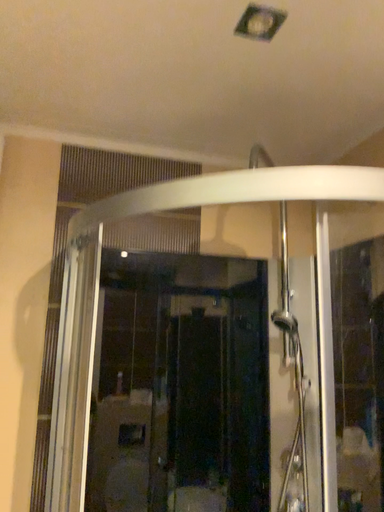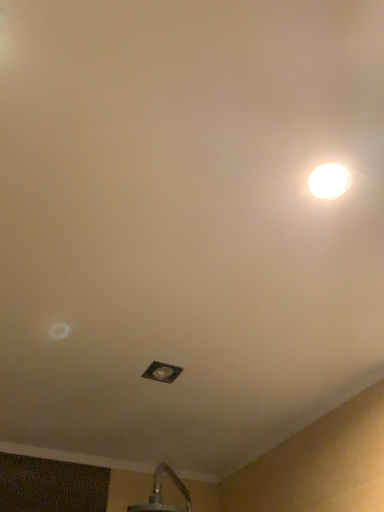
Question: Which way did the camera rotate in the video?

Choices:
 (A) rotated upward
 (B) rotated downward

Answer: (A)